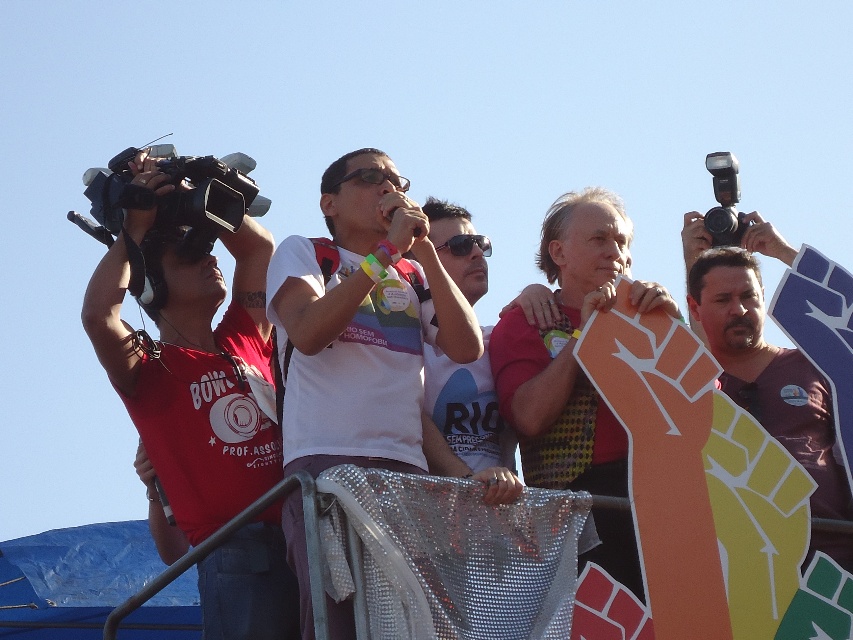
Which is below, matte brown shirt at center or clear plastic goggles at center?

Positioned lower is matte brown shirt at center.

Is matte brown shirt at center below clear plastic goggles at center?

Yes, matte brown shirt at center is below clear plastic goggles at center.

Locate an element on the screen. This screenshot has height=640, width=853. matte brown shirt at center is located at coordinates (763, 355).

Is matte brown shirt at center behind black plastic video camera at upper left?

No, it is in front of black plastic video camera at upper left.

Can you confirm if matte brown shirt at center is bigger than black plastic video camera at upper left?

Yes.

Does point (698, 292) lie in front of point (171, 196)?

That is False.

Where is `matte brown shirt at center`? The height and width of the screenshot is (640, 853). matte brown shirt at center is located at coordinates (763, 355).

Between white t-shirt at center and clear plastic goggles at center, which one appears on the left side from the viewer's perspective?

white t-shirt at center

Does point (397, 440) come farther from viewer compared to point (393, 184)?

No, (397, 440) is in front of (393, 184).

Identify the location of white t-shirt at center. click(361, 326).

Where is `white t-shirt at center`? white t-shirt at center is located at coordinates (361, 326).